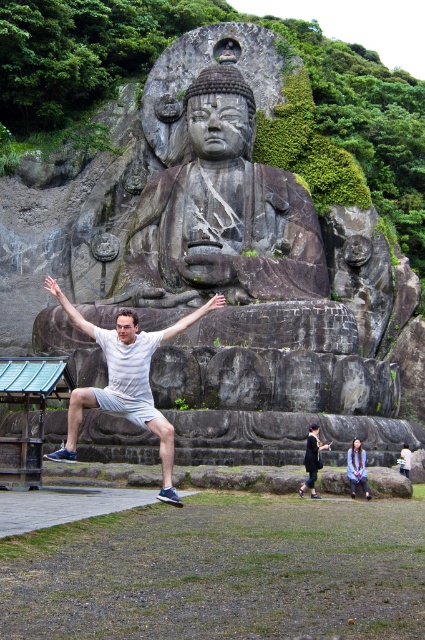
Between white cotton shirt at center and white matte arm at upper center, which one appears on the right side from the viewer's perspective?

Positioned to the right is white cotton shirt at center.

Between point (68, 449) and point (68, 307), which one is positioned in front?

Point (68, 449)

Describe the element at coordinates (125, 380) in the screenshot. The width and height of the screenshot is (425, 640). I see `white cotton shirt at center` at that location.

This screenshot has width=425, height=640. Find the location of `white cotton shirt at center`. white cotton shirt at center is located at coordinates (125, 380).

Is denim jacket at lower right shorter than white matte arm at center?

Yes, denim jacket at lower right is shorter than white matte arm at center.

Which of these two, denim jacket at lower right or white matte arm at center, stands taller?

white matte arm at center is taller.

This screenshot has width=425, height=640. Identify the location of denim jacket at lower right. (357, 467).

Is point (325, 444) behind point (166, 333)?

Yes, point (325, 444) is farther from viewer.

How distant is black fabric bag at lower center from white matte arm at center?

They are 53.35 feet apart.

Find the location of a particular element. The height and width of the screenshot is (640, 425). black fabric bag at lower center is located at coordinates tap(311, 460).